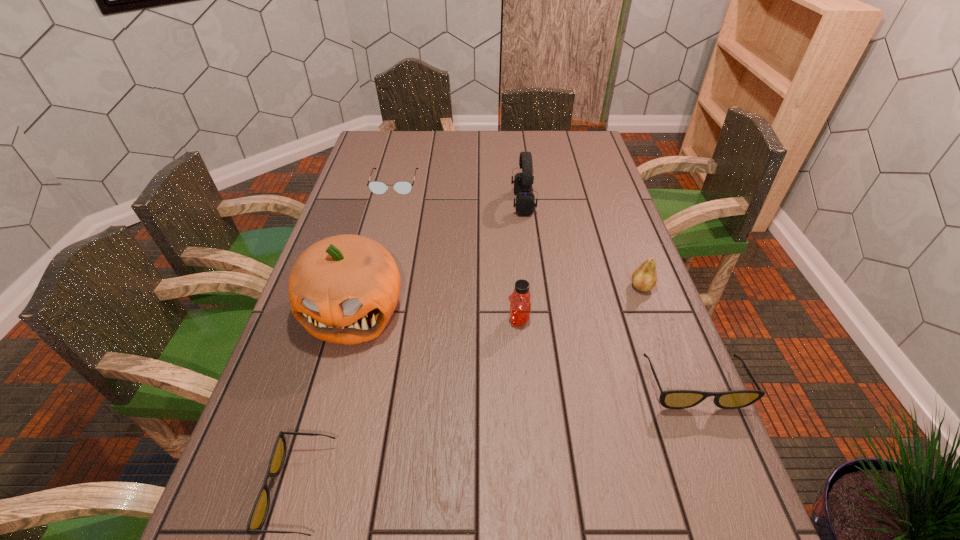
I want to click on pear positioned at the right edge, so click(644, 278).

Where is `free region at the far edge`? This screenshot has height=540, width=960. free region at the far edge is located at coordinates (517, 140).

Identify the location of free space at the left edge of the desktop. (x=256, y=429).

You are a GUI agent. You are given a task and a screenshot of the screen. Output one action in this format:
    pyautogui.click(x=<x>, y=<y>)
    Task: Click on the vacant area at the right edge of the desktop
    
    Given the screenshot: What is the action you would take?
    pyautogui.click(x=582, y=161)

This screenshot has height=540, width=960. In the image, there is a desktop. In order to click on blank space at the far left corner in this screenshot , I will do `click(367, 136)`.

Locate an element on the screen. free spot at the far right corner of the desktop is located at coordinates (563, 146).

Where is `vacant space in between the farther sunglasses and the tallest object`? vacant space in between the farther sunglasses and the tallest object is located at coordinates [524, 348].

At what (x,y) coordinates should I click in order to perform the action: click on vacant point located between the pear and the pumpkin. Please return your answer as a coordinate pair (x, y). The image size is (960, 540). Looking at the image, I should click on (497, 299).

You are a GUI agent. You are given a task and a screenshot of the screen. Output one action in this format:
    pyautogui.click(x=<x>, y=<y>)
    Task: Click on the vacant space that's between the second tallest object and the honey
    
    Given the screenshot: What is the action you would take?
    pyautogui.click(x=520, y=261)

The width and height of the screenshot is (960, 540). In order to click on free spot between the spectacles and the pear in this screenshot , I will do `click(518, 235)`.